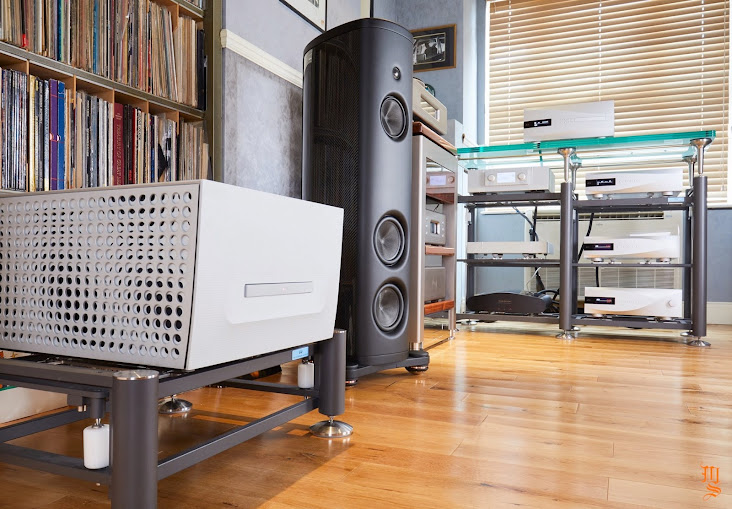
Locate an element on the screen. legs of tables is located at coordinates (141, 441), (337, 356), (569, 300), (701, 294), (417, 311), (460, 286).